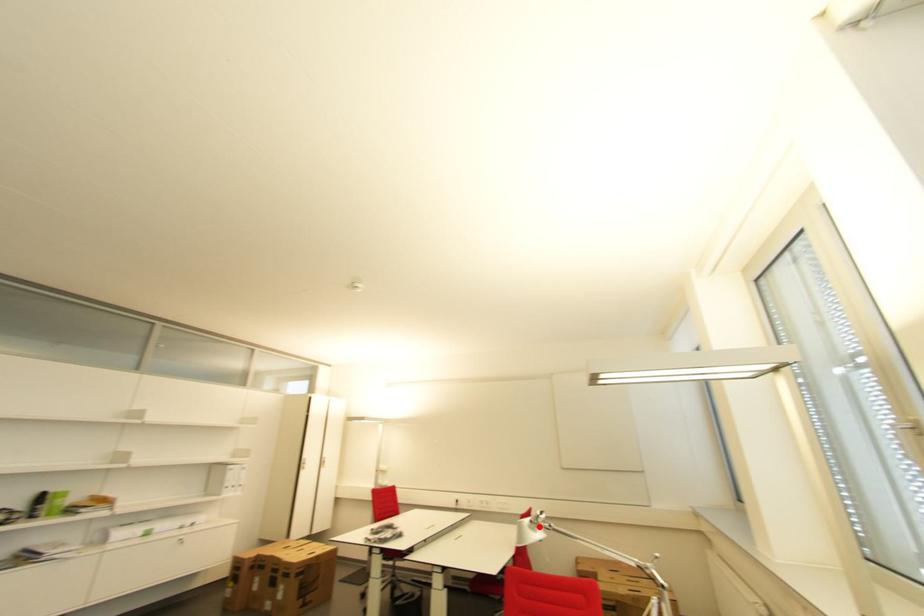
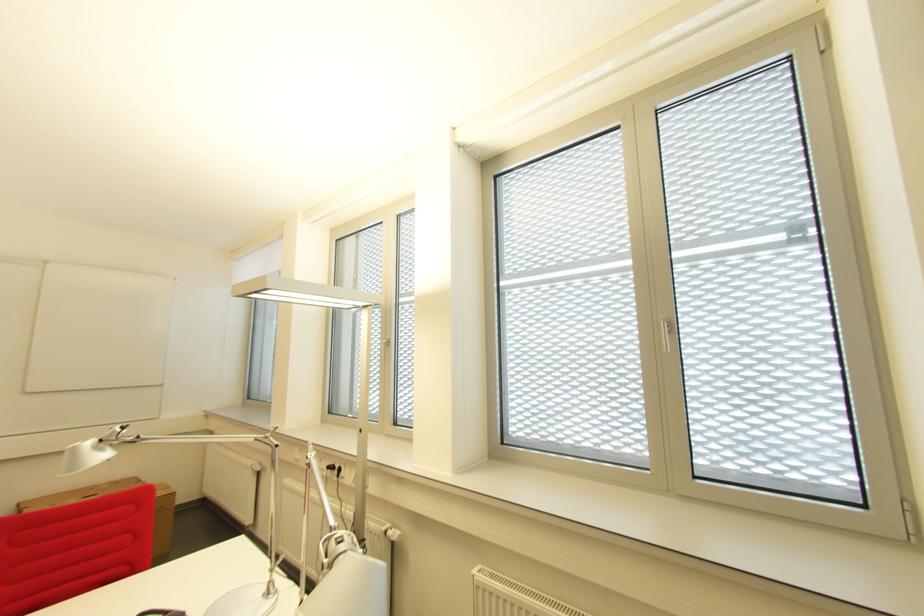
Question: I am providing you with two images of the same scene from different viewpoints. Image1 has a red point marked. In image2, the corresponding 3D location appears at what relative position? Reply with the corresponding letter.

Choices:
 (A) Closer
 (B) Farther

Answer: (B)